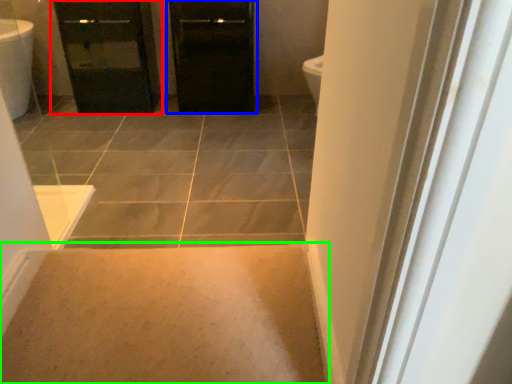
Question: Based on their relative distances, which object is nearer to bathroom cabinet (highlighted by a red box)? Choose from door (highlighted by a blue box) and plain (highlighted by a green box).

Choices:
 (A) door
 (B) plain

Answer: (A)